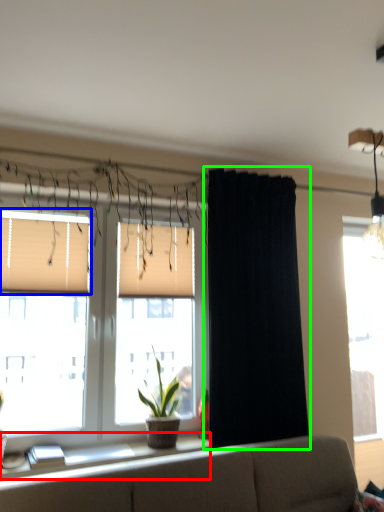
Question: Which is farther away from window sill (highlighted by a red box)? window blind (highlighted by a blue box) or curtain (highlighted by a green box)?

Choices:
 (A) window blind
 (B) curtain

Answer: (A)